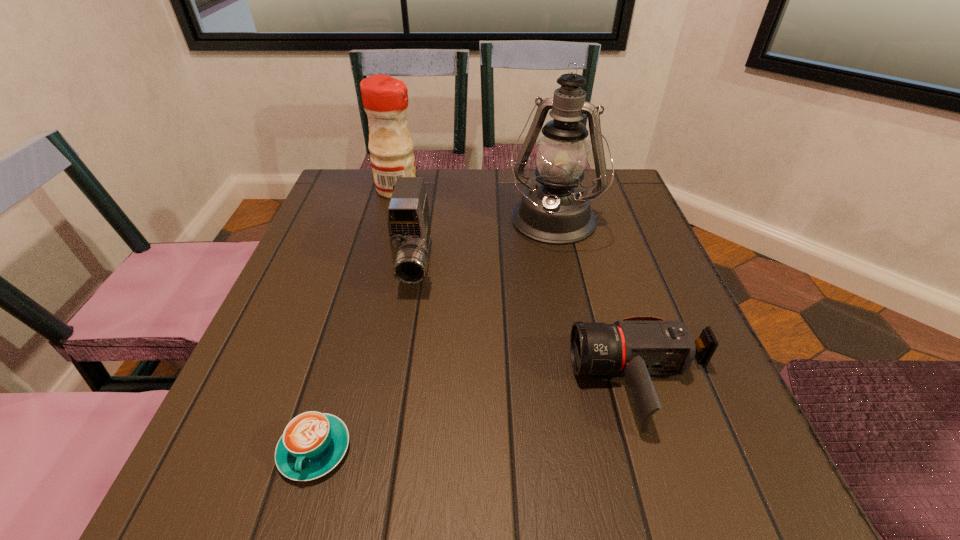
Find the location of `blank space located 0.290m on the lens of the right camcorder`. blank space located 0.290m on the lens of the right camcorder is located at coordinates (398, 382).

Where is `blank area located 0.200m on the lens of the right camcorder`? The image size is (960, 540). blank area located 0.200m on the lens of the right camcorder is located at coordinates (453, 382).

The height and width of the screenshot is (540, 960). In order to click on free spot located on the lens of the right camcorder in this screenshot , I will do `click(369, 382)`.

Where is `oil lamp present at the far edge`? oil lamp present at the far edge is located at coordinates (556, 211).

At what (x,y) coordinates should I click in order to perform the action: click on condiment that is at the far edge. Please return your answer as a coordinate pair (x, y). The width and height of the screenshot is (960, 540). Looking at the image, I should click on (385, 99).

The image size is (960, 540). In order to click on object positioned at the near edge in this screenshot , I will do `click(313, 443)`.

The width and height of the screenshot is (960, 540). What are the coordinates of `condiment that is at the left edge` in the screenshot? It's located at (385, 99).

Where is `cappuccino that is at the left edge`? Image resolution: width=960 pixels, height=540 pixels. cappuccino that is at the left edge is located at coordinates (313, 443).

I want to click on oil lamp present at the right edge, so click(x=556, y=211).

The height and width of the screenshot is (540, 960). I want to click on camcorder that is at the right edge, so click(636, 347).